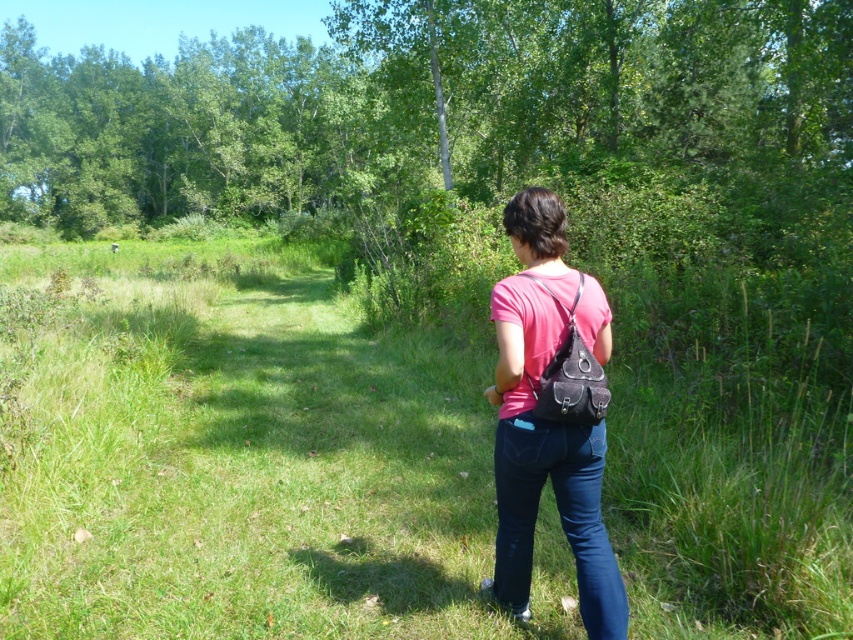
Consider the image. Does green grassy at center appear under pink fabric shirt at center?

Incorrect, green grassy at center is not positioned below pink fabric shirt at center.

Is green grassy at center further to camera compared to pink fabric shirt at center?

Yes, green grassy at center is behind pink fabric shirt at center.

Which is behind, point (405, 513) or point (514, 451)?

The point (405, 513) is behind.

Where is `green grassy at center`? The image size is (853, 640). green grassy at center is located at coordinates (241, 456).

From the picture: Is green grassy at center below denim at center?

No.

Looking at this image, who is positioned more to the right, green grassy at center or denim at center?

From the viewer's perspective, denim at center appears more on the right side.

I want to click on green grassy at center, so click(x=241, y=456).

Where is `green grassy at center`? green grassy at center is located at coordinates (241, 456).

Is pink fabric shirt at center wider than denim at center?

Correct, the width of pink fabric shirt at center exceeds that of denim at center.

Between pink fabric shirt at center and denim at center, which one is positioned lower?

Positioned lower is denim at center.

Is point (514, 477) positioned after point (578, 460)?

Yes, it is.

Find the location of `pink fabric shirt at center`. pink fabric shirt at center is located at coordinates (548, 420).